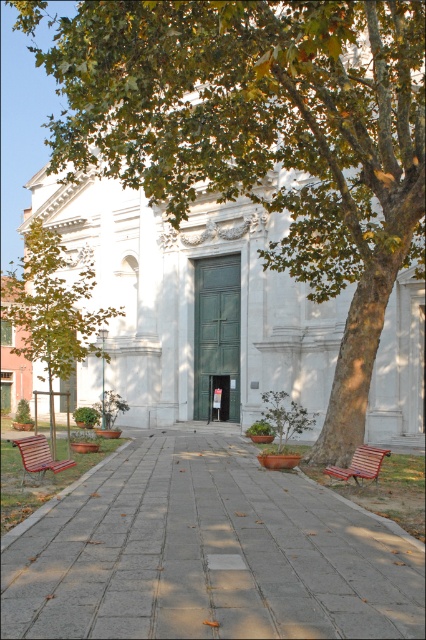
You are standing at the point with coordinates [207,554]. Based on the scene description, where are you located?

You are located at the paved stone walkway at center.